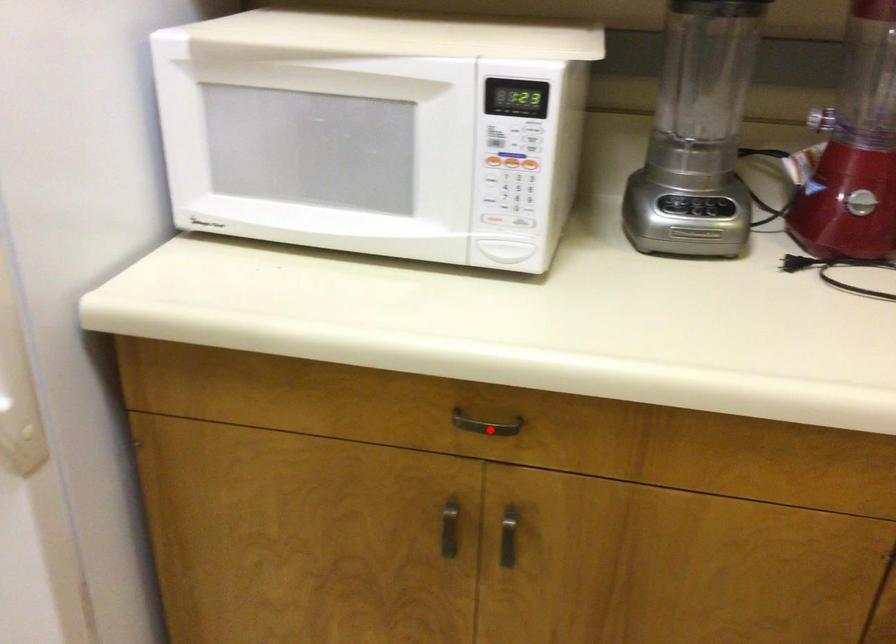
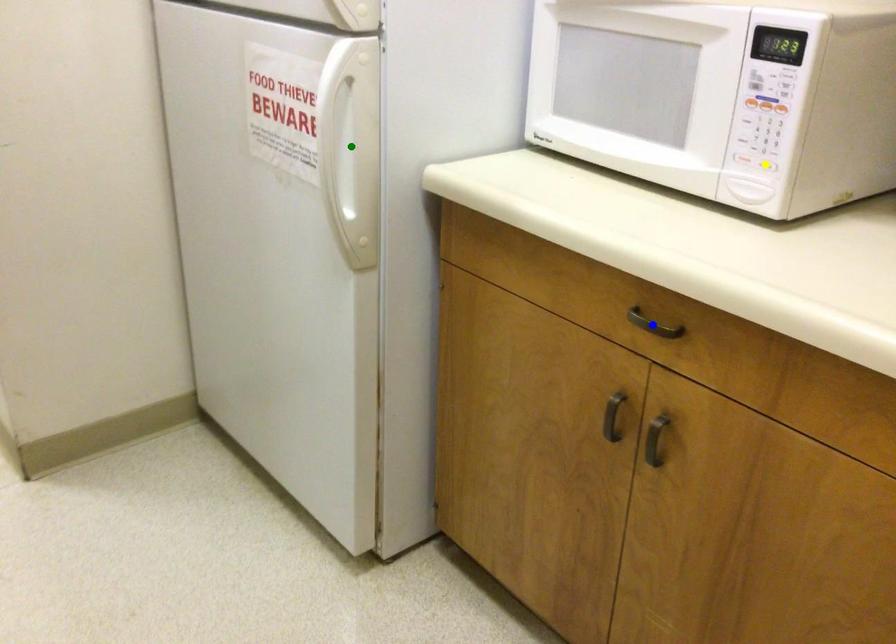
Question: I am providing you with two images of the same scene from different viewpoints. A red point is marked on the first image. You are given multiple points on the second image. Which mark in image 2 goes with the point in image 1?

Choices:
 (A) blue point
 (B) green point
 (C) yellow point

Answer: (A)